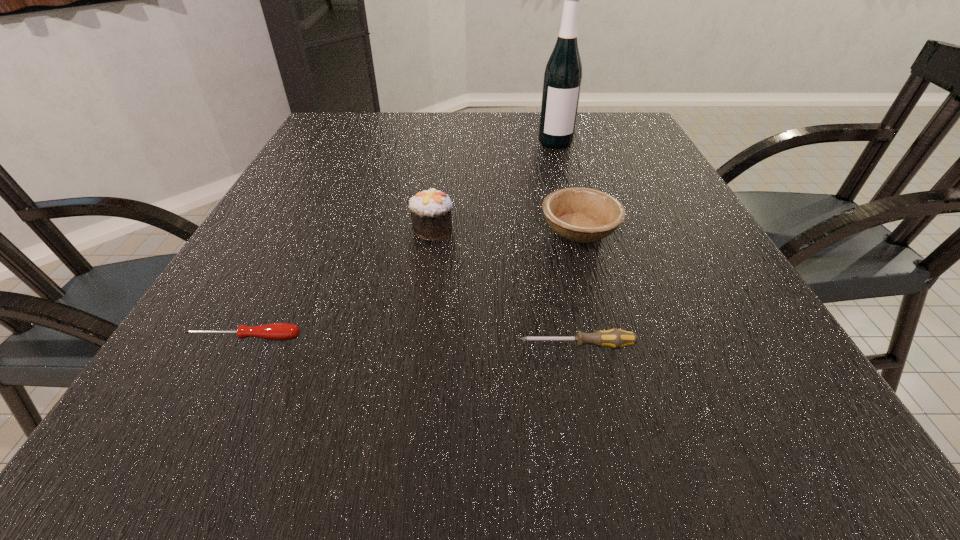
You are a GUI agent. You are given a task and a screenshot of the screen. Output one action in this format:
    pyautogui.click(x=<x>, y=<y>)
    Task: Click on the vacant area at the far right corner
    
    Given the screenshot: What is the action you would take?
    pyautogui.click(x=635, y=133)

The width and height of the screenshot is (960, 540). I want to click on vacant space at the near right corner of the desktop, so click(741, 455).

Find the location of a particular element. The height and width of the screenshot is (540, 960). free area in between the right screwdriver and the left screwdriver is located at coordinates (411, 342).

Where is `free space between the second object from left to right and the farthest object`? Image resolution: width=960 pixels, height=540 pixels. free space between the second object from left to right and the farthest object is located at coordinates (494, 185).

The image size is (960, 540). Find the location of `vacant space that is in between the third tallest object and the tallest object`. vacant space that is in between the third tallest object and the tallest object is located at coordinates (567, 186).

Locate an element on the screen. Image resolution: width=960 pixels, height=540 pixels. vacant space that's between the third shortest object and the wine bottle is located at coordinates (567, 186).

Where is `vacant area that lies between the wine bottle and the left screwdriver`? The image size is (960, 540). vacant area that lies between the wine bottle and the left screwdriver is located at coordinates (399, 240).

The width and height of the screenshot is (960, 540). I want to click on vacant space that's between the leftmost object and the right screwdriver, so (411, 342).

Locate an element on the screen. The height and width of the screenshot is (540, 960). free space between the tallest object and the bowl is located at coordinates (567, 186).

This screenshot has height=540, width=960. In order to click on free spot between the bowl and the tallest object in this screenshot , I will do `click(567, 186)`.